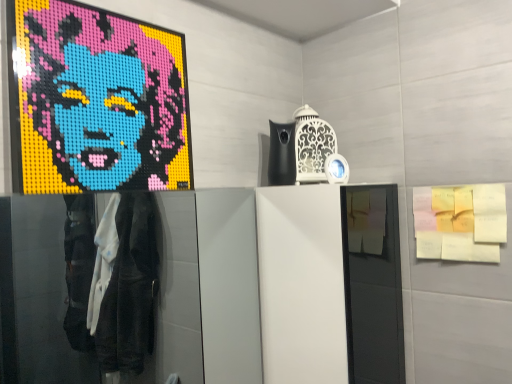
The image size is (512, 384). What do you see at coordinates (460, 222) in the screenshot?
I see `yellow sticky notes at upper right` at bounding box center [460, 222].

Find the location of a particular element. This screenshot has height=384, width=512. yellow sticky notes at upper right is located at coordinates (x=460, y=222).

Where is `brick mosaic portrait at upper left`? Image resolution: width=512 pixels, height=384 pixels. brick mosaic portrait at upper left is located at coordinates (100, 101).

The width and height of the screenshot is (512, 384). What do you see at coordinates (100, 101) in the screenshot?
I see `brick mosaic portrait at upper left` at bounding box center [100, 101].

Locate an element on the screen. This screenshot has width=512, height=384. yellow sticky notes at upper right is located at coordinates (460, 222).

Is brick mosaic portrait at upper left to the left of yellow sticky notes at upper right from the viewer's perspective?

Correct, you'll find brick mosaic portrait at upper left to the left of yellow sticky notes at upper right.

Is brick mosaic portrait at upper left closer to camera compared to yellow sticky notes at upper right?

Yes.

Is point (160, 120) closer to viewer compared to point (488, 193)?

Yes, it is.

From the image's perspective, which is above, brick mosaic portrait at upper left or yellow sticky notes at upper right?

From the image's view, brick mosaic portrait at upper left is above.

From a real-world perspective, is brick mosaic portrait at upper left located higher than yellow sticky notes at upper right?

Yes, from a real-world perspective, brick mosaic portrait at upper left is above yellow sticky notes at upper right.

Considering the sizes of objects brick mosaic portrait at upper left and yellow sticky notes at upper right in the image provided, who is wider, brick mosaic portrait at upper left or yellow sticky notes at upper right?

Wider between the two is yellow sticky notes at upper right.

In terms of height, does brick mosaic portrait at upper left look taller or shorter compared to yellow sticky notes at upper right?

In the image, brick mosaic portrait at upper left appears to be taller than yellow sticky notes at upper right.

Between brick mosaic portrait at upper left and yellow sticky notes at upper right, which one has smaller size?

With smaller size is yellow sticky notes at upper right.

Do you think brick mosaic portrait at upper left is within yellow sticky notes at upper right, or outside of it?

brick mosaic portrait at upper left cannot be found inside yellow sticky notes at upper right.

Is there a large distance between brick mosaic portrait at upper left and yellow sticky notes at upper right?

Actually, brick mosaic portrait at upper left and yellow sticky notes at upper right are a little close together.

Is yellow sticky notes at upper right at the back of brick mosaic portrait at upper left?

No, brick mosaic portrait at upper left's orientation is not away from yellow sticky notes at upper right.

How different are the orientations of brick mosaic portrait at upper left and yellow sticky notes at upper right in degrees?

They differ by 84.6 degrees in their facing directions.

This screenshot has height=384, width=512. I want to click on poster located on the right of brick mosaic portrait at upper left, so click(460, 222).

Between yellow sticky notes at upper right and brick mosaic portrait at upper left, which one appears on the left side from the viewer's perspective?

Positioned to the left is brick mosaic portrait at upper left.

Between yellow sticky notes at upper right and brick mosaic portrait at upper left, which one is positioned behind?

yellow sticky notes at upper right is further away from the camera.

Which is closer to the camera, (493, 186) or (109, 81)?

Point (493, 186).

From the image's perspective, which is below, yellow sticky notes at upper right or brick mosaic portrait at upper left?

From the image's view, yellow sticky notes at upper right is below.

From a real-world perspective, which is physically above, yellow sticky notes at upper right or brick mosaic portrait at upper left?

brick mosaic portrait at upper left is physically above.

Does yellow sticky notes at upper right have a greater width compared to brick mosaic portrait at upper left?

Correct, the width of yellow sticky notes at upper right exceeds that of brick mosaic portrait at upper left.

Considering the sizes of objects yellow sticky notes at upper right and brick mosaic portrait at upper left in the image provided, who is shorter, yellow sticky notes at upper right or brick mosaic portrait at upper left?

With less height is yellow sticky notes at upper right.

Considering the relative sizes of yellow sticky notes at upper right and brick mosaic portrait at upper left in the image provided, is yellow sticky notes at upper right bigger than brick mosaic portrait at upper left?

Incorrect, yellow sticky notes at upper right is not larger than brick mosaic portrait at upper left.

From the picture: Is brick mosaic portrait at upper left a part of yellow sticky notes at upper right?

No, brick mosaic portrait at upper left is not a part of yellow sticky notes at upper right.

Is yellow sticky notes at upper right positioned far away from brick mosaic portrait at upper left?

No, yellow sticky notes at upper right is not far away from brick mosaic portrait at upper left.

Is yellow sticky notes at upper right aimed at brick mosaic portrait at upper left?

No, yellow sticky notes at upper right is not aimed at brick mosaic portrait at upper left.

Consider the image. How many degrees apart are the facing directions of yellow sticky notes at upper right and brick mosaic portrait at upper left?

There is a 84.6-degree angle between the facing directions of yellow sticky notes at upper right and brick mosaic portrait at upper left.

The image size is (512, 384). What are the coordinates of `person that is above the yellow sticky notes at upper right (from the image's perspective)` in the screenshot? It's located at (100, 101).

Image resolution: width=512 pixels, height=384 pixels. I want to click on poster on the right of brick mosaic portrait at upper left, so click(x=460, y=222).

Locate an element on the screen. The width and height of the screenshot is (512, 384). person that appears in front of the yellow sticky notes at upper right is located at coordinates (100, 101).